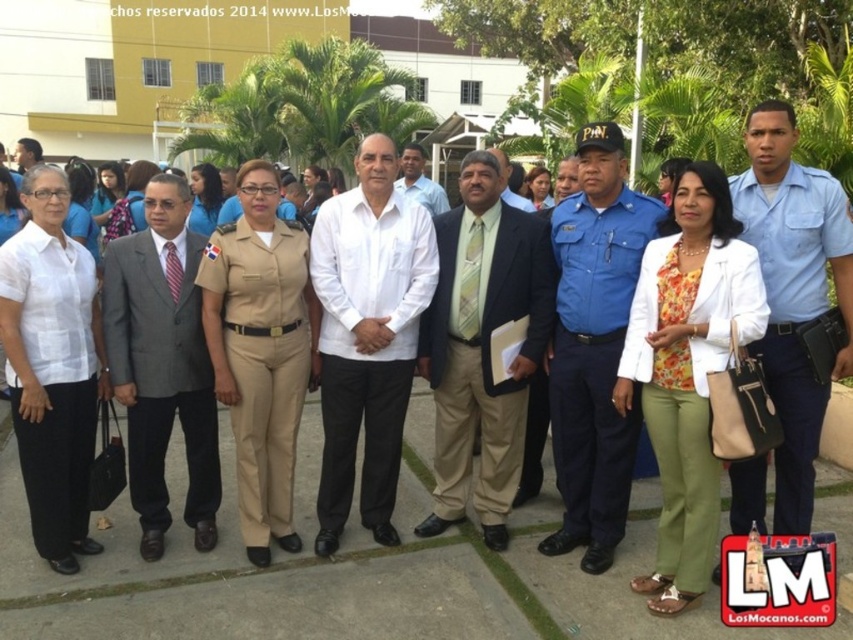
Question: Which of the following is the closest to the observer?

Choices:
 (A) (769, 164)
 (B) (148, 180)
 (C) (505, 173)

Answer: (A)

Question: Which point is farther from the camera taking this photo?

Choices:
 (A) (456, 340)
 (B) (235, 401)
 (C) (132, 380)

Answer: (A)

Question: Considering the real-world distances, which object is closest to the light brown uniform at center?

Choices:
 (A) tan uniform at center
 (B) gray suit at center

Answer: (A)

Question: Is blue uniform at center closer to camera compared to white shirt at center?

Choices:
 (A) no
 (B) yes

Answer: (B)

Question: Is the position of blue uniform at center more distant than that of tan uniform at center?

Choices:
 (A) yes
 (B) no

Answer: (B)

Question: Does blue uniform at center have a smaller size compared to gray suit at center?

Choices:
 (A) no
 (B) yes

Answer: (B)